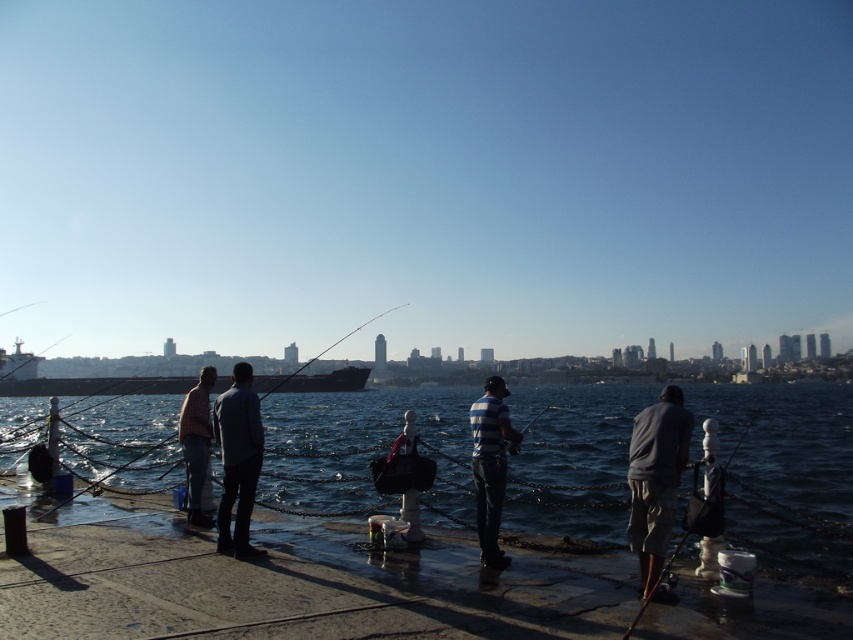
You are a photographer trying to capture a clear shot of the matte black fishing pole at right without the concrete dock at lower center blocking it. How should you adjust your position?

Move to the right side so that the concrete dock at lower center is no longer blocking the view of the matte black fishing pole at right.

From the picture: You are a photographer trying to capture a shot of the dark blue water at center and the gray fabric shorts at right. Based on their positions, which object is closer to the right edge of the image?

The gray fabric shorts at right are closer to the right edge of the image since the dark blue water at center is positioned on the right side of it.